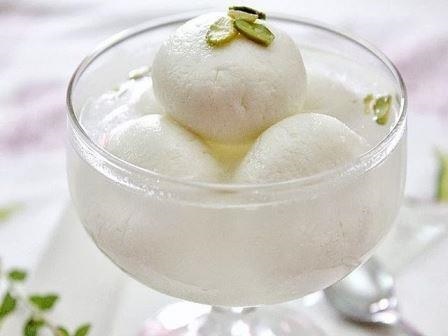
Where is `glass`? glass is located at coordinates (247, 249).